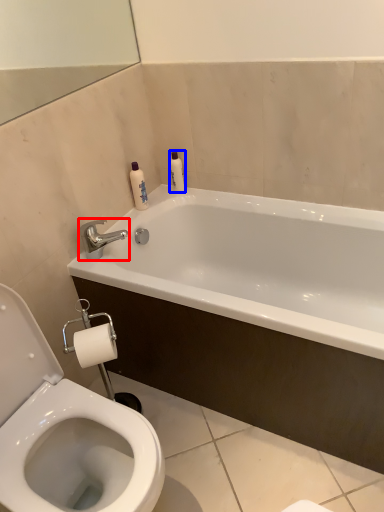
Question: Among these objects, which one is farthest to the camera, tap (highlighted by a red box) or toiletry (highlighted by a blue box)?

Choices:
 (A) tap
 (B) toiletry

Answer: (B)